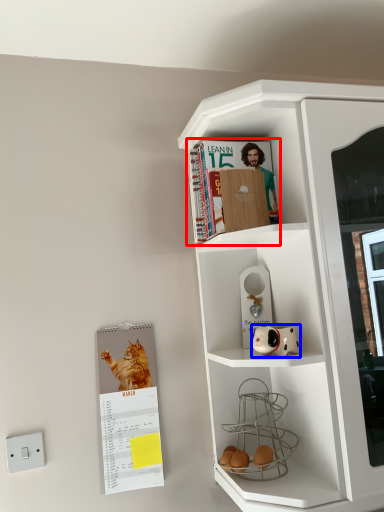
Question: Among these objects, which one is nearest to the camera, magazine (highlighted by a red box) or toy (highlighted by a blue box)?

Choices:
 (A) magazine
 (B) toy

Answer: (B)